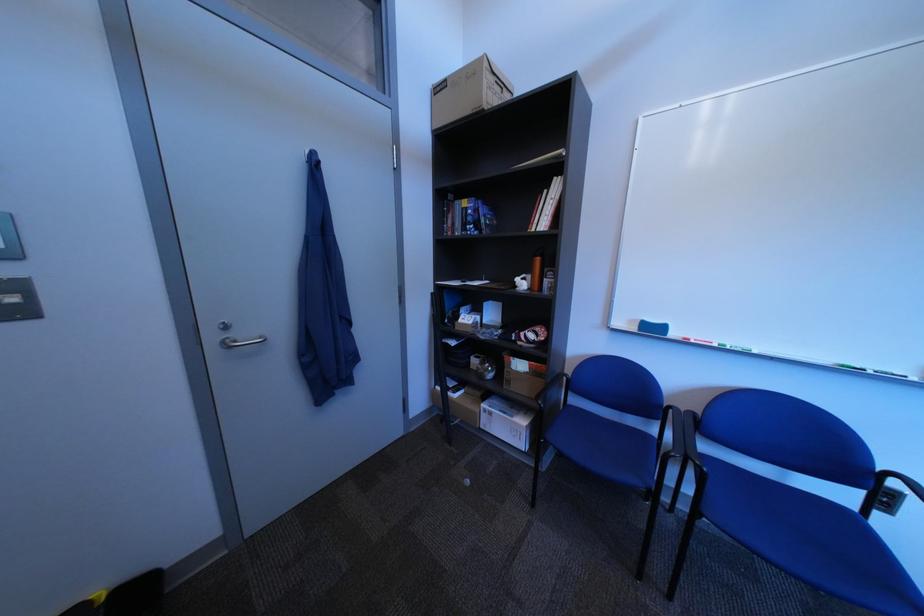
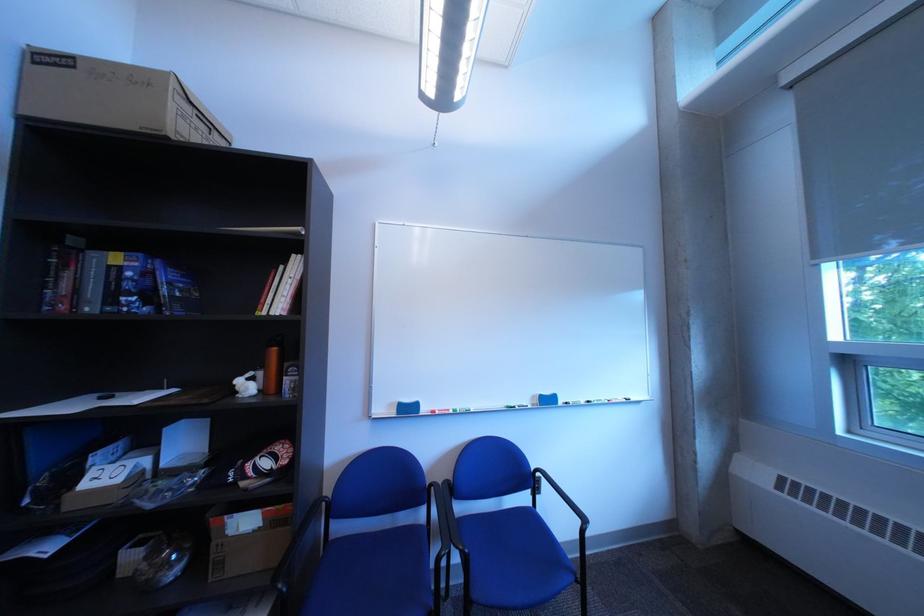
In the second image, find the point that corresponds to [647,323] in the first image.

(406, 407)